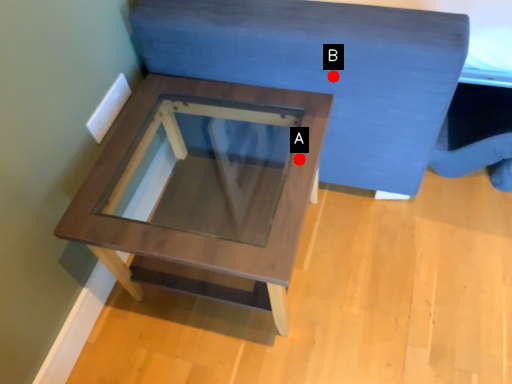
Question: Two points are circled on the image, labeled by A and B beside each circle. Which point appears farthest from the camera in this image?

Choices:
 (A) A is further
 (B) B is further

Answer: (B)